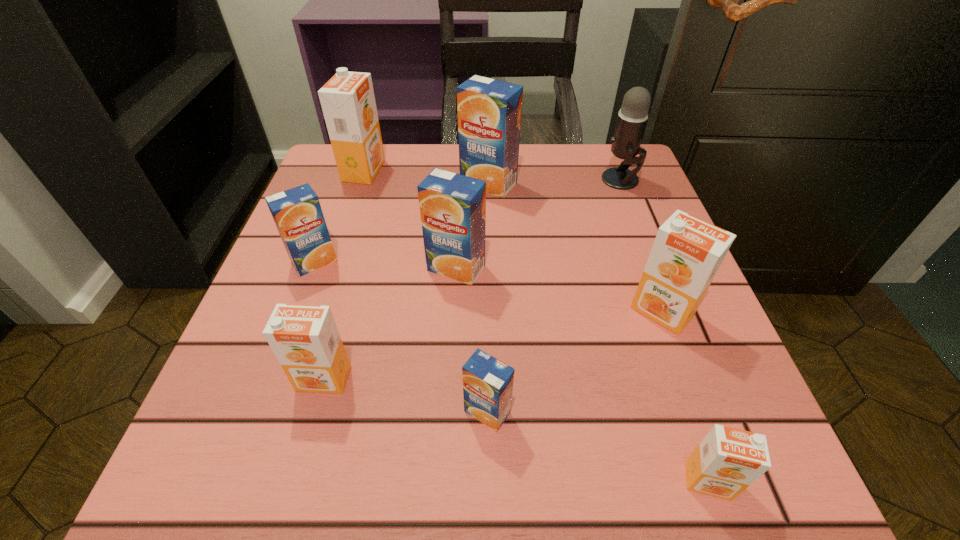
You are a GUI agent. You are given a task and a screenshot of the screen. Output one action in this format:
    pyautogui.click(x=<x>, y=<y>)
    Task: Click on the microphone present at the far edge
    Image resolution: width=960 pixels, height=540 pixels.
    Given the screenshot: What is the action you would take?
    pyautogui.click(x=632, y=117)

Locate an element on the screen. This screenshot has height=540, width=960. microphone that is positioned at the right edge is located at coordinates (632, 117).

Find the location of a particular element. object that is positioned at the far left corner is located at coordinates (347, 100).

I want to click on object present at the far right corner, so click(x=632, y=117).

Locate an element on the screen. Image resolution: width=960 pixels, height=540 pixels. object that is at the near right corner is located at coordinates (727, 461).

You are a GUI agent. You are given a task and a screenshot of the screen. Output one action in this format:
    pyautogui.click(x=<x>, y=<y>)
    Task: Click on the free space at the far edge of the desktop
    This screenshot has width=960, height=540.
    Given the screenshot: What is the action you would take?
    pyautogui.click(x=423, y=179)

The height and width of the screenshot is (540, 960). I want to click on vacant point at the near edge, so click(526, 460).

Image resolution: width=960 pixels, height=540 pixels. In the image, there is a desktop. Find the location of `vacant region at the left edge`. vacant region at the left edge is located at coordinates (325, 269).

In the image, there is a desktop. At what (x,y) coordinates should I click in order to perform the action: click on vacant space at the right edge. Please return your answer as a coordinate pair (x, y). Image resolution: width=960 pixels, height=540 pixels. Looking at the image, I should click on [x=625, y=368].

Where is `free space at the far right corner`? free space at the far right corner is located at coordinates (606, 194).